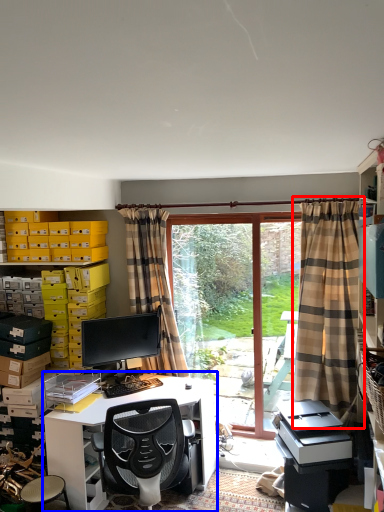
Question: Which object appears farthest to the camera in this image, curtain (highlighted by a red box) or computer desk (highlighted by a blue box)?

Choices:
 (A) curtain
 (B) computer desk

Answer: (A)